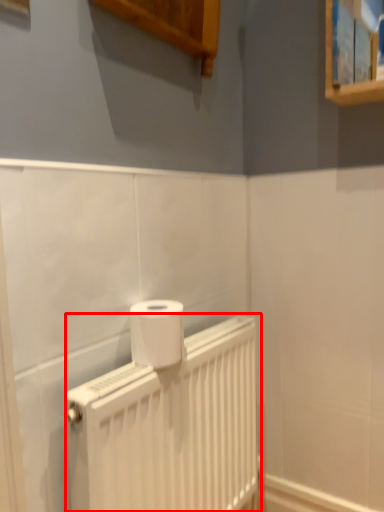
Question: From the image's perspective, where is radiator (annotated by the red box) located relative to toilet paper?

Choices:
 (A) above
 (B) below

Answer: (B)